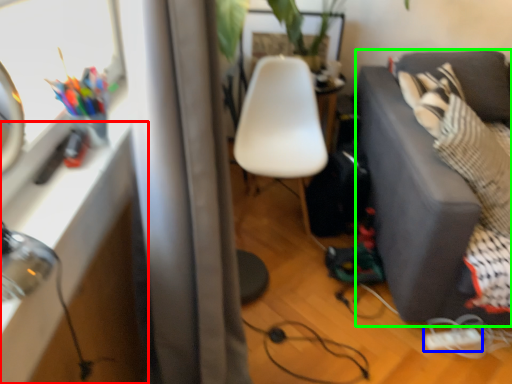
Question: Estimate the real-world distances between objects in this image. Which object is closer to table (highlighted by a red box), extension cord (highlighted by a blue box) or studio couch (highlighted by a green box)?

Choices:
 (A) extension cord
 (B) studio couch

Answer: (B)